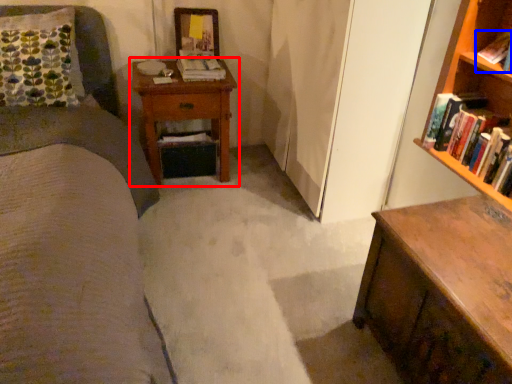
Question: Which of the following is the closest to the observer, nightstand (highlighted by a red box) or book (highlighted by a blue box)?

Choices:
 (A) nightstand
 (B) book

Answer: (B)